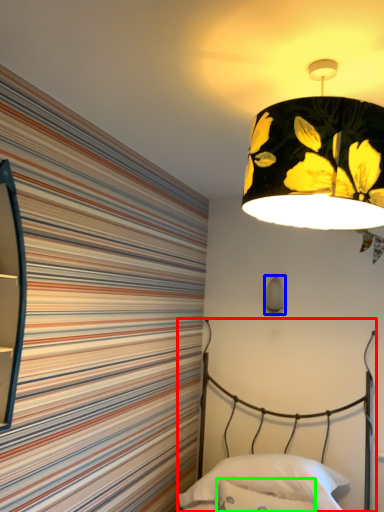
Question: Which object is the closest to the bed (highlighted by a red box)? Choose among these: lamp (highlighted by a blue box) or throw pillow (highlighted by a green box).

Choices:
 (A) lamp
 (B) throw pillow

Answer: (B)